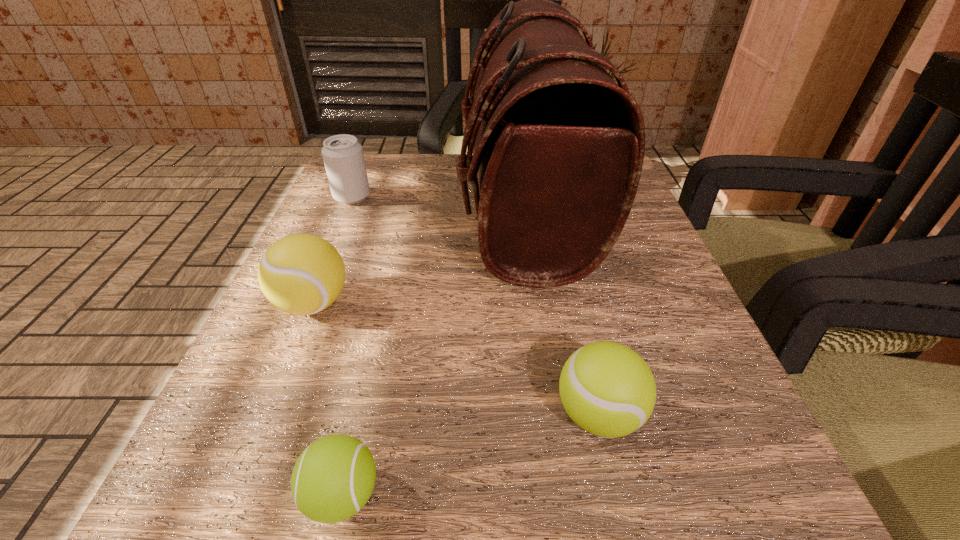
Identify which tennis ball is located as the nearest to the farthest tennis ball. Please provide its 2D coordinates. Your answer should be formatted as a tuple, i.e. [(x, y)], where the tuple contains the x and y coordinates of a point satisfying the conditions above.

[(333, 478)]

Locate an element on the screen. This screenshot has width=960, height=540. vacant space that satisfies the following two spatial constraints: 1. on the front-facing side of the tallest object; 2. on the right side of the fourth farthest object is located at coordinates (555, 414).

At what (x,y) coordinates should I click in order to perform the action: click on vacant region that satisfies the following two spatial constraints: 1. on the front side of the leftmost tennis ball; 2. on the right side of the can. Please return your answer as a coordinate pair (x, y). Looking at the image, I should click on (307, 303).